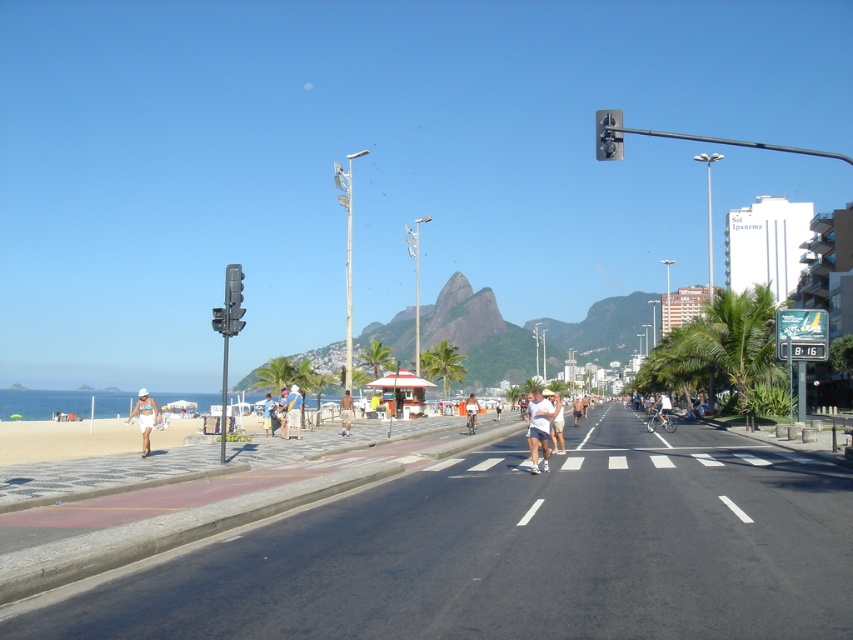
You are a photographer standing on the sidewalk bordered by the low wall on the left side of the road. You want to take a photo of the tan skin person at center and the light blue shorts at center. Which object will appear larger in your photo?

The tan skin person at center will appear larger in the photo because they are closer to the viewer than the light blue shorts at center.

You are a photographer standing at the point marked by point (x=346, y=412). You want to capture a photo of the tan skin person at center. Is the tan skin person at center within your current field of view?

The point (x=346, y=412) marks the tan skin person at center, so yes, the tan skin person at center is directly at that point and within your current field of view.

You are a photographer standing at the edge of the road, wanting to capture a photo of the tan skin person at center and the light blue denim shorts at center. Which object appears wider in your camera view?

The light blue denim shorts at center appears wider than the tan skin person at center since the tan skin person at center has a smaller width according to the description.